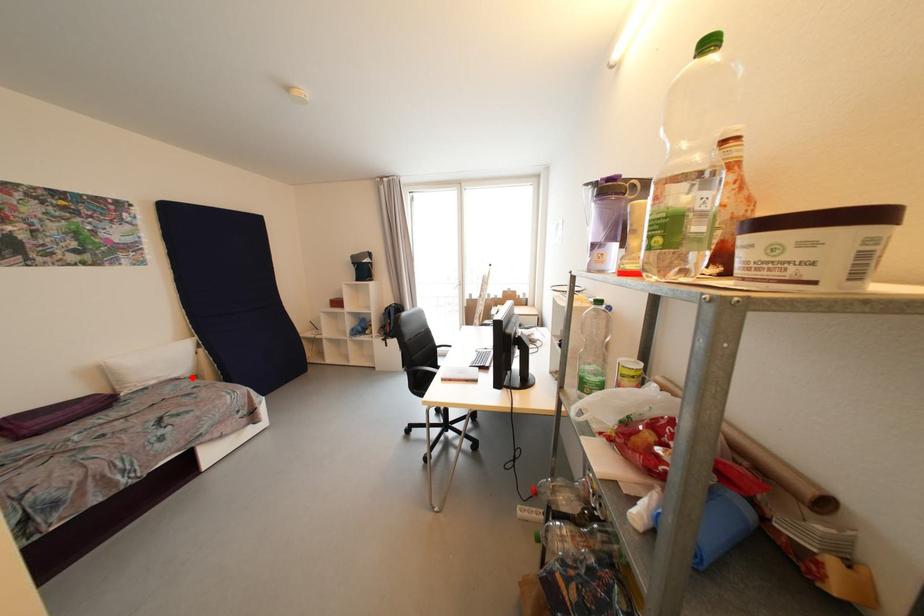
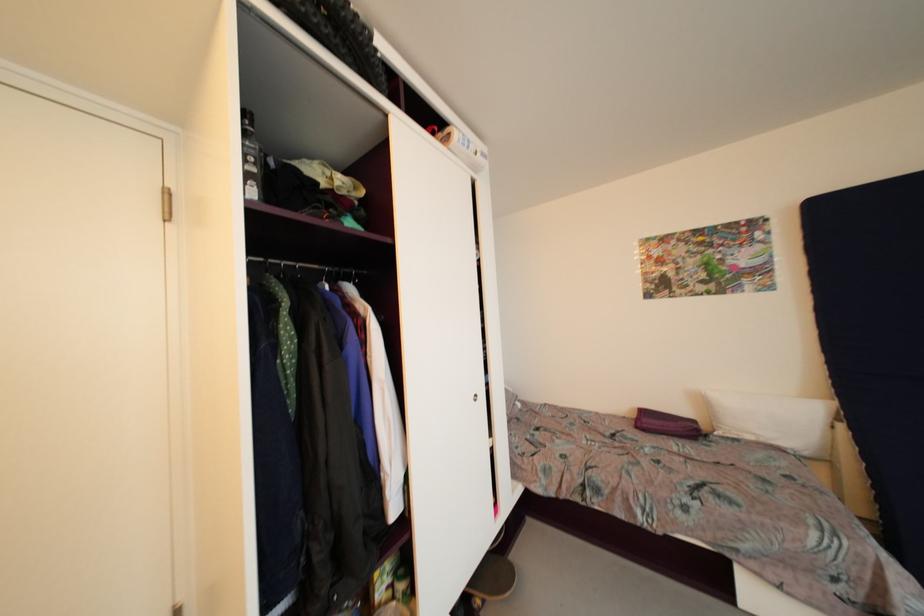
Question: I am providing you with two images of the same scene from different viewpoints. A red point is marked on the first image. Is the red point's position out of view in image 2?

Choices:
 (A) Yes
 (B) No

Answer: (B)